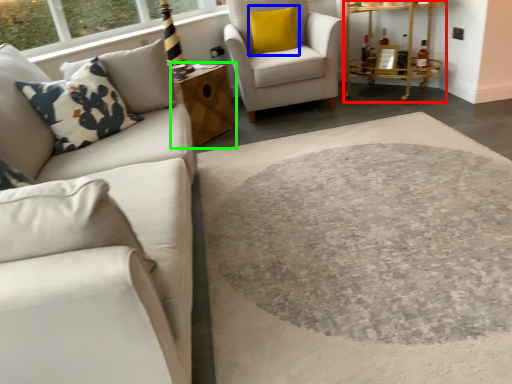
Question: Considering the real-world distances, which object is farthest from table (highlighted by a red box)? pillow (highlighted by a blue box) or table (highlighted by a green box)?

Choices:
 (A) pillow
 (B) table

Answer: (B)